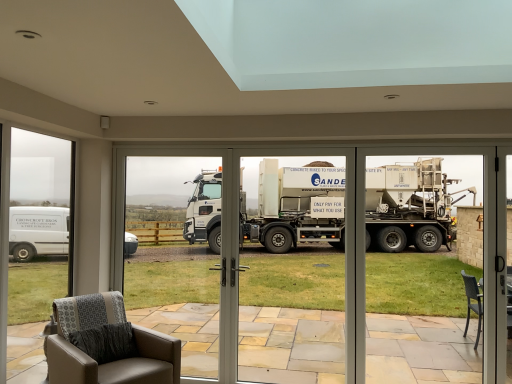
Question: Which direction should I rotate to look at white matte truck at center, placed as the 1th garage door when sorted from left to right, — up or down?

Choices:
 (A) up
 (B) down

Answer: (B)

Question: Can you confirm if white matte truck at center, the 2th garage door viewed from the right, is positioned to the left of transparent glass door at center?

Choices:
 (A) no
 (B) yes

Answer: (A)

Question: Is the depth of white matte truck at center, placed as the 1th garage door when sorted from left to right, greater than that of transparent glass door at center?

Choices:
 (A) no
 (B) yes

Answer: (A)

Question: From the image's perspective, is white matte truck at center, placed as the 1th garage door when sorted from left to right, beneath transparent glass door at center?

Choices:
 (A) yes
 (B) no

Answer: (A)

Question: Does white matte truck at center, the 2th garage door viewed from the right, appear on the right side of transparent glass door at center?

Choices:
 (A) yes
 (B) no

Answer: (A)

Question: Considering the relative positions of white matte truck at center, placed as the 1th garage door when sorted from left to right, and transparent glass door at center in the image provided, is white matte truck at center, placed as the 1th garage door when sorted from left to right, in front of transparent glass door at center?

Choices:
 (A) yes
 (B) no

Answer: (A)

Question: Would you say white matte truck at center, placed as the 1th garage door when sorted from left to right, contains transparent glass door at center?

Choices:
 (A) no
 (B) yes

Answer: (A)

Question: Is white glossy truck at center, which is the second garage door in left-to-right order, directly adjacent to white matte truck at center, the 2th garage door viewed from the right?

Choices:
 (A) no
 (B) yes

Answer: (A)

Question: Is white glossy truck at center, which is the second garage door in left-to-right order, at the right side of white matte truck at center, placed as the 1th garage door when sorted from left to right?

Choices:
 (A) yes
 (B) no

Answer: (A)

Question: Is white glossy truck at center, which ranks as the first garage door in right-to-left order, aimed at white matte truck at center, placed as the 1th garage door when sorted from left to right?

Choices:
 (A) no
 (B) yes

Answer: (B)

Question: Does white glossy truck at center, which is the second garage door in left-to-right order, have a lesser height compared to white matte truck at center, the 2th garage door viewed from the right?

Choices:
 (A) yes
 (B) no

Answer: (A)

Question: Is white glossy truck at center, which ranks as the first garage door in right-to-left order, positioned behind white matte truck at center, the 2th garage door viewed from the right?

Choices:
 (A) yes
 (B) no

Answer: (B)

Question: Would you say white glossy truck at center, which is the second garage door in left-to-right order, is outside white matte truck at center, the 2th garage door viewed from the right?

Choices:
 (A) no
 (B) yes

Answer: (A)

Question: Is transparent glass door at center not inside leather armchair at lower left?

Choices:
 (A) no
 (B) yes

Answer: (B)